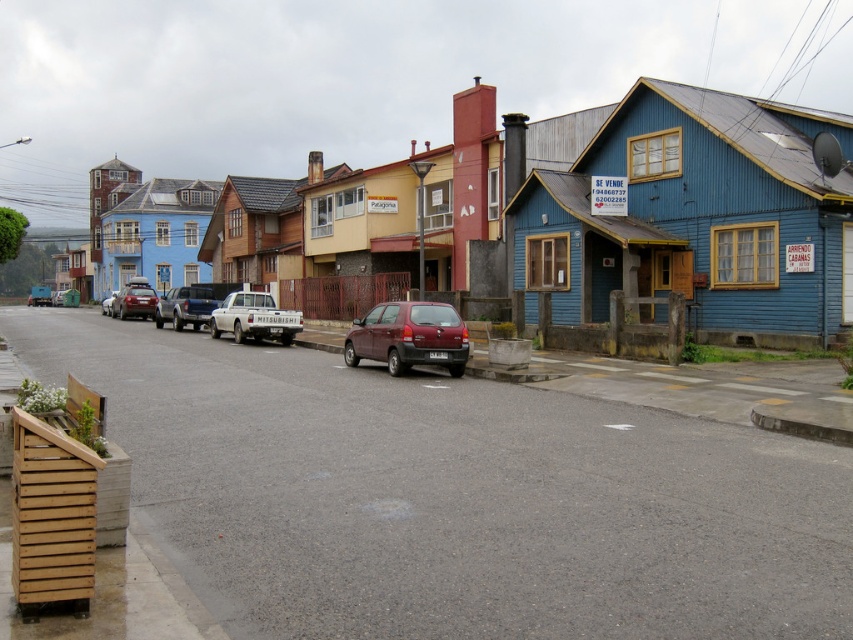
Question: Can you confirm if maroon matte hatchback at center is positioned to the right of metallic silver sedan at center?

Choices:
 (A) yes
 (B) no

Answer: (A)

Question: Is maroon matte hatchback at center to the left of matte red car at center from the viewer's perspective?

Choices:
 (A) yes
 (B) no

Answer: (B)

Question: Among these objects, which one is farthest from the camera?

Choices:
 (A) matte red car at center
 (B) maroon matte hatchback at center
 (C) white matte pickup truck at center

Answer: (A)

Question: Which point is closer to the camera taking this photo?

Choices:
 (A) (138, 300)
 (B) (262, 324)
 (C) (108, 305)

Answer: (B)

Question: Can you confirm if maroon matte hatchback at center is positioned to the right of brushed metal truck at center?

Choices:
 (A) no
 (B) yes

Answer: (B)

Question: Which point is closer to the camera?

Choices:
 (A) metallic silver sedan at center
 (B) white matte pickup truck at center

Answer: (B)